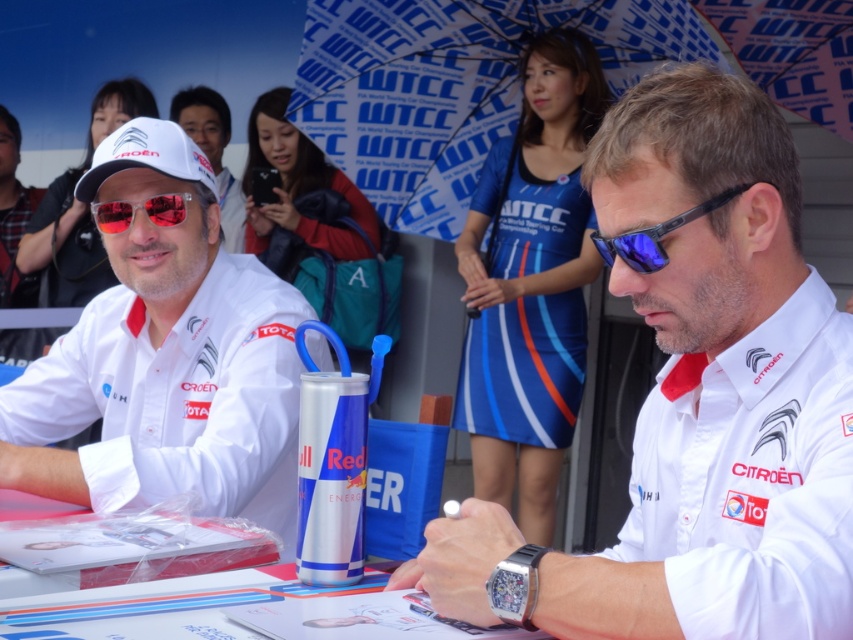
Question: Estimate the real-world distances between objects in this image. Which object is farther from the transparent plastic goggles at center?

Choices:
 (A) white matte shirt at center
 (B) blue printed umbrella at upper center
 (C) blue reflective lens sunglasses at center

Answer: (B)

Question: Among these objects, which one is farthest from the camera?

Choices:
 (A) transparent plastic goggles at center
 (B) blue reflective lens sunglasses at center

Answer: (A)

Question: Which of these objects is positioned closest to the blue fabric dress at upper center?

Choices:
 (A) blue reflective lens sunglasses at center
 (B) white matte shirt at center
 (C) transparent plastic goggles at center
 (D) blue printed umbrella at upper center

Answer: (D)

Question: Is blue fabric dress at upper center further to the viewer compared to blue reflective lens sunglasses at center?

Choices:
 (A) no
 (B) yes

Answer: (B)

Question: Can you confirm if blue printed umbrella at upper center is positioned to the left of transparent plastic goggles at center?

Choices:
 (A) no
 (B) yes

Answer: (A)

Question: Can you confirm if blue printed umbrella at upper center is smaller than blue fabric dress at upper center?

Choices:
 (A) yes
 (B) no

Answer: (B)